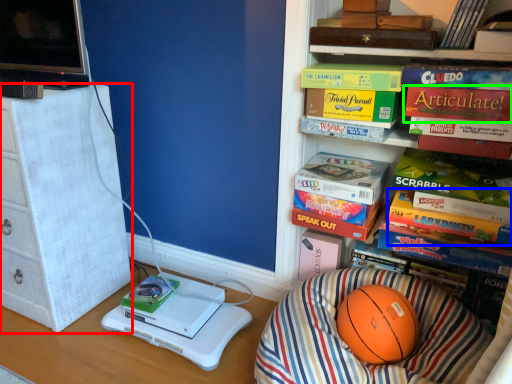
Question: Which object is the closest to the furniture (highlighted by a red box)? Choose among these: paperback book (highlighted by a blue box) or paperback book (highlighted by a green box).

Choices:
 (A) paperback book
 (B) paperback book

Answer: (A)